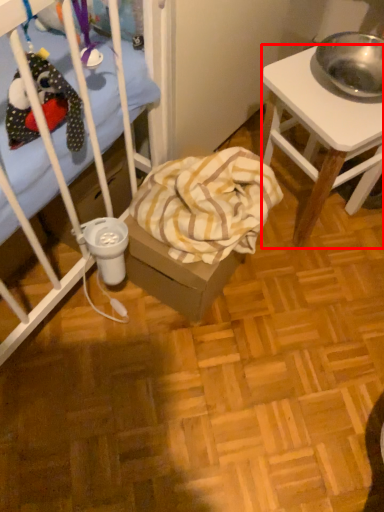
Question: In this image, where is desk (annotated by the red box) located relative to blanket?

Choices:
 (A) right
 (B) left

Answer: (A)